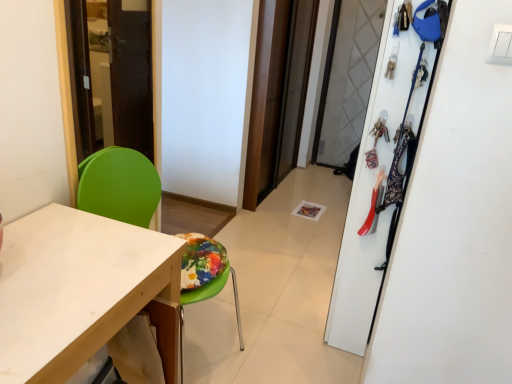
Identify the location of vacant position to the left of white matte closet at upper right. The width and height of the screenshot is (512, 384). (289, 313).